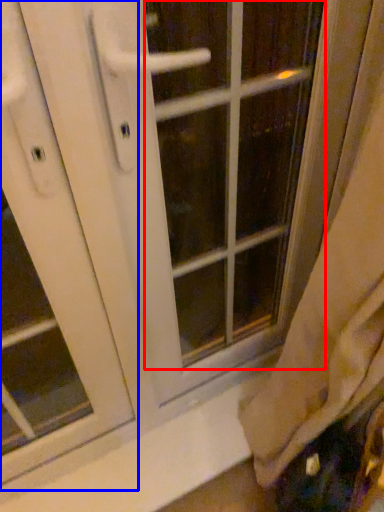
Question: Which of the following is the farthest to the observer, glass door (highlighted by a red box) or screen door (highlighted by a blue box)?

Choices:
 (A) glass door
 (B) screen door

Answer: (A)